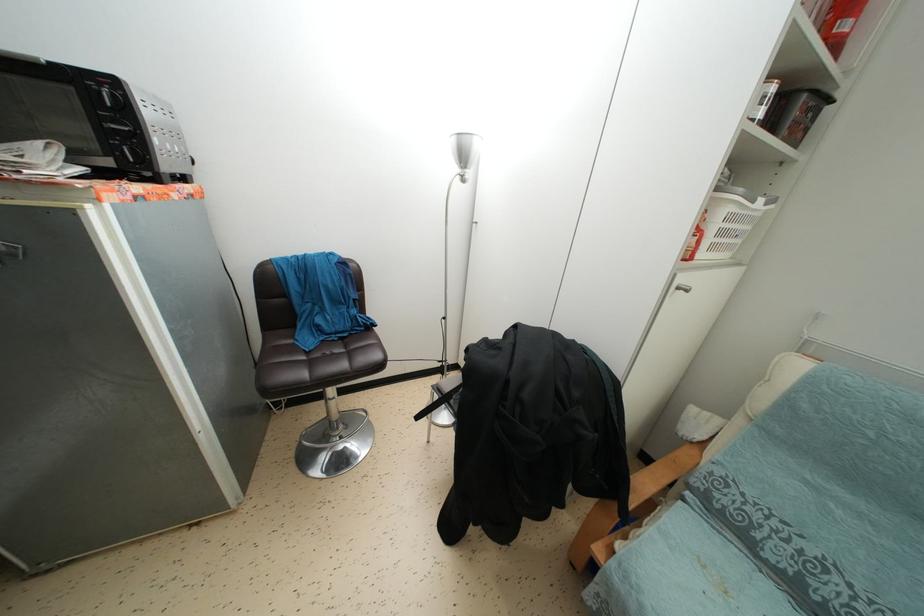
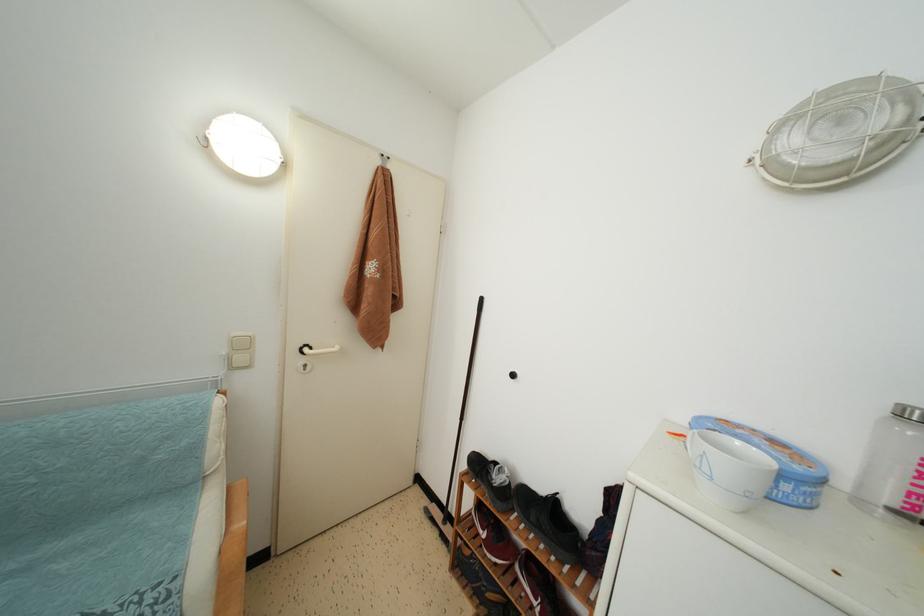
How did the camera likely rotate?

The camera's rotation is toward right-down.